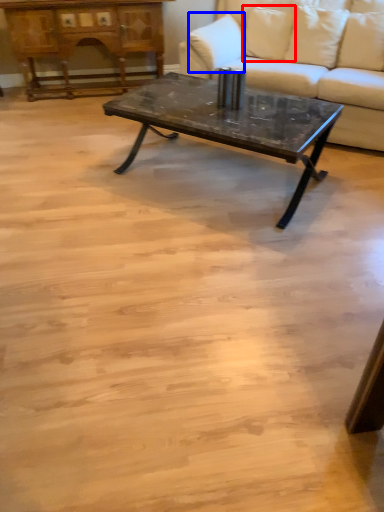
Question: Which point is further to the camera, pillow (highlighted by a red box) or pillow (highlighted by a blue box)?

Choices:
 (A) pillow
 (B) pillow

Answer: (A)